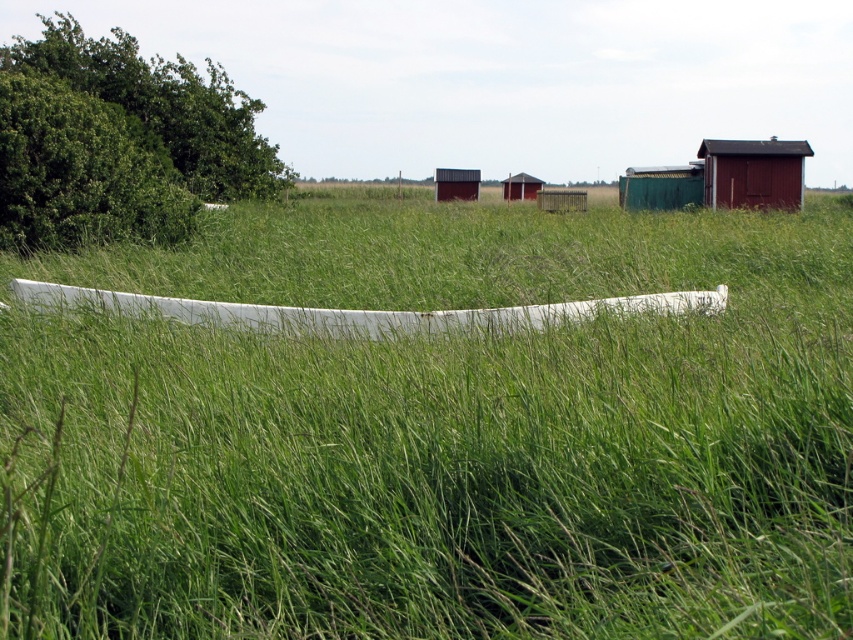
You are a farmer planning to place a new tool shed between the matte red wooden hut at upper right and the rustic wooden hut at center. Considering their sizes, which existing hut should the new shed be closer to for balance?

The matte red wooden hut at upper right is wider than the rustic wooden hut at center. To balance the layout, the new shed should be placed closer to the wider matte red wooden hut at upper right to counterbalance its larger size.

You are standing at the point marked as point (x=753, y=172) in the rural scene. What structure are you currently located on?

You are standing on the matte red wooden hut at upper right because the point (x=753, y=172) is located on it.

You are standing at the point with coordinates point (746,140) and want to walk to the point with coordinates point (456,170). Which direction should you move to get closer to your destination?

You should move backward because point (746,140) is in front of point (456,170), so moving backward will bring you closer to point (456,170).